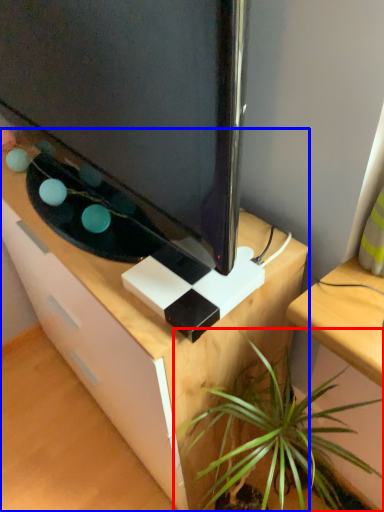
Question: Which of the following is the farthest to the observer, houseplant (highlighted by a red box) or desk (highlighted by a blue box)?

Choices:
 (A) houseplant
 (B) desk

Answer: (B)